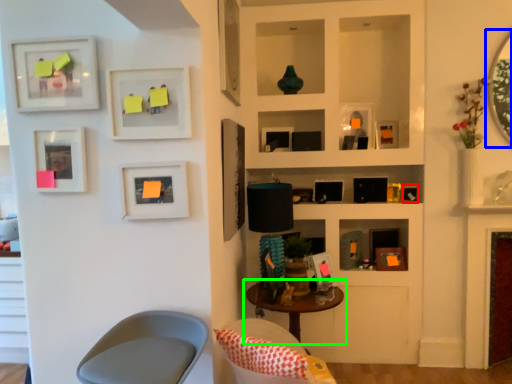
Question: Which is farther away from picture frame (highlighted by a red box)? mirror (highlighted by a blue box) or table (highlighted by a green box)?

Choices:
 (A) mirror
 (B) table

Answer: (B)